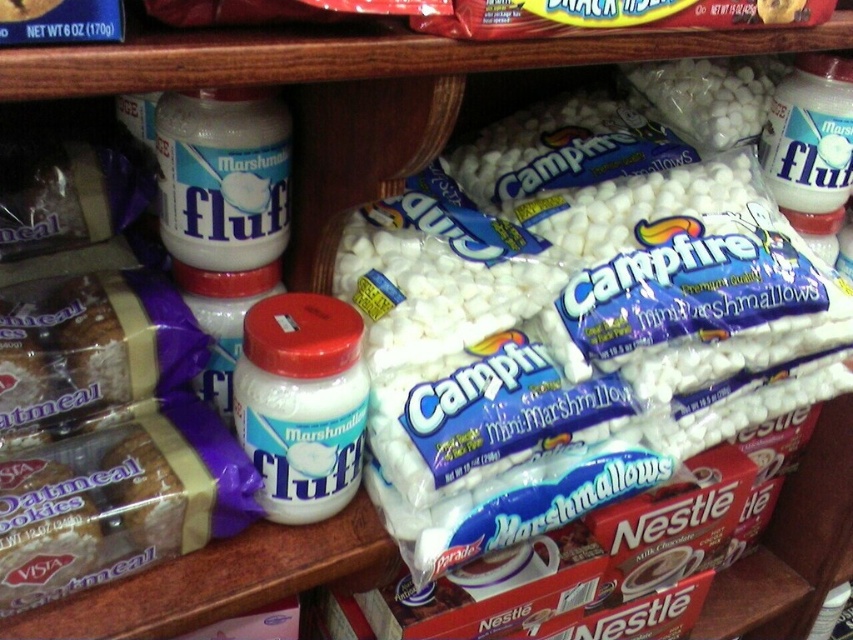
You are standing in front of a store shelf with marshmallow products. You see a white matte jar at center left and a point marked at coordinate (300, 403). Can you determine if the point is located on the white matte jar at center left?

The point (300, 403) corresponds to the white matte jar at center left, so yes, the point is located on the white matte jar at center left.